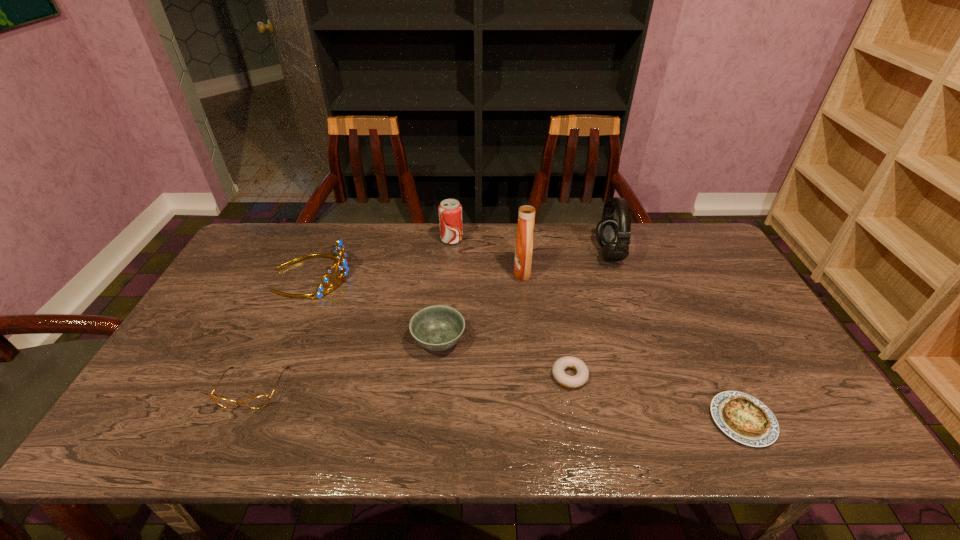
Locate an element on the screen. The width and height of the screenshot is (960, 540). free point between the sixth tallest object and the third object from right to left is located at coordinates (411, 382).

The image size is (960, 540). I want to click on free spot between the rightmost object and the soda can, so click(x=597, y=330).

You are a GUI agent. You are given a task and a screenshot of the screen. Output one action in this format:
    pyautogui.click(x=<x>, y=<y>)
    Task: Click on the vacant space that's between the second tallest object and the fourth shortest object
    Image resolution: width=960 pixels, height=540 pixels.
    Given the screenshot: What is the action you would take?
    pyautogui.click(x=524, y=298)

The height and width of the screenshot is (540, 960). Identify the location of unoccupied position between the detergent and the sixth object from left to right. (546, 323).

Image resolution: width=960 pixels, height=540 pixels. I want to click on free space between the tiara and the bowl, so click(375, 308).

Where is `vacant space that's between the detergent and the soda can`? This screenshot has height=540, width=960. vacant space that's between the detergent and the soda can is located at coordinates (487, 255).

This screenshot has height=540, width=960. I want to click on object that ranks as the sixth closest to the rightmost object, so click(338, 250).

Identify which object is located as the third nearest to the sixth object from left to right. Please provide its 2D coordinates. Your answer should be formatted as a tuple, i.e. [(x, y)], where the tuple contains the x and y coordinates of a point satisfying the conditions above.

[(524, 240)]

Find the location of a particular element. This screenshot has height=540, width=960. vacant area that satisfies the following two spatial constraints: 1. on the earcups of the quiche; 2. on the left side of the second tallest object is located at coordinates (668, 420).

Find the location of a particular element. The height and width of the screenshot is (540, 960). vacant space that satisfies the following two spatial constraints: 1. on the front-facing side of the detergent; 2. on the front-facing side of the spectacles is located at coordinates (535, 388).